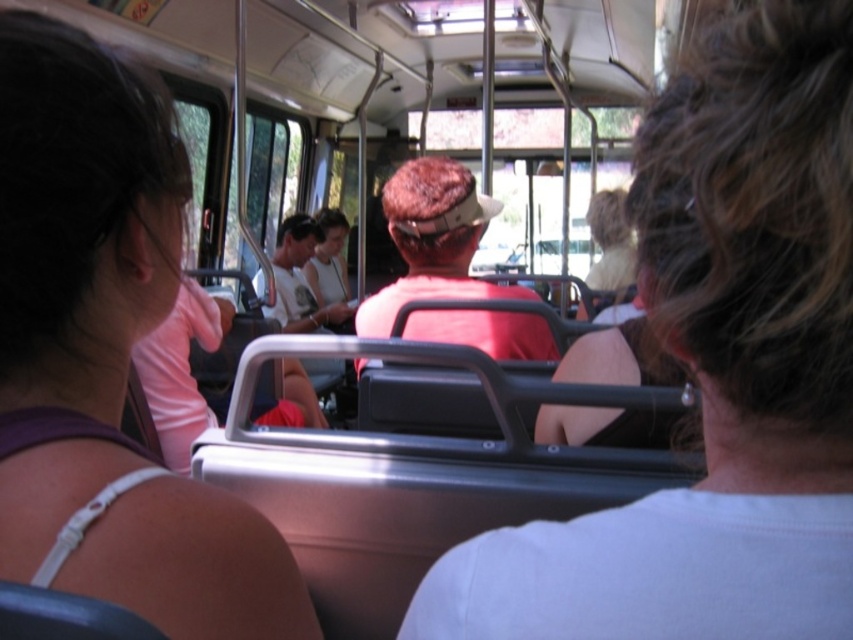
You are a passenger sitting in the front of the bus. You notice two people ahead of you. One has white matte hair at upper right and the other is wearing a matte red shirt at center. Which of these two is positioned to the right side of the bus?

The white matte hair at upper right is positioned to the right of the matte red shirt at center, so the person with white matte hair at upper right is on the right side of the bus.

You are a delivery robot with a 1.2 meter wide package. You need to move from the back of the bus to the front. There is a narrow path between the purple fabric shirt at upper left and the matte red shirt at center. Can your package fit through that path?

The distance between the purple fabric shirt at upper left and the matte red shirt at center is 1.44 meters. Since your package is 1.2 meters wide, it can fit through the path as the width is sufficient.

Looking at this image, you are a passenger sitting in the front of a moving bus. You see a purple fabric shirt at upper left and a matte red shirt at center. Which shirt is located to the left of the other?

The purple fabric shirt at upper left is positioned on the left side of matte red shirt at center.